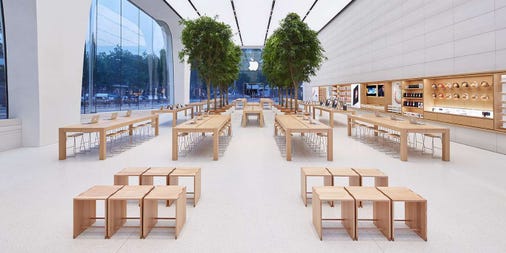
Find the location of `chairs`. chairs is located at coordinates (119, 137).